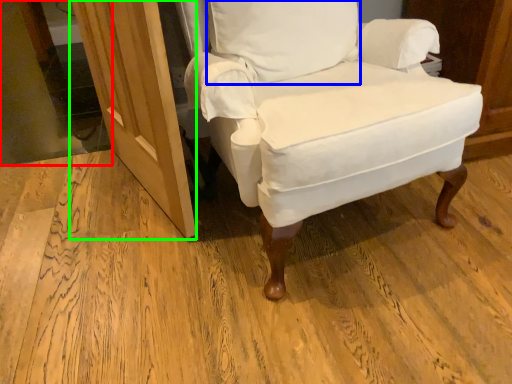
Question: Estimate the real-world distances between objects in this image. Which object is farther from glass door (highlighted by a red box), pillow (highlighted by a blue box) or screen door (highlighted by a green box)?

Choices:
 (A) pillow
 (B) screen door

Answer: (A)